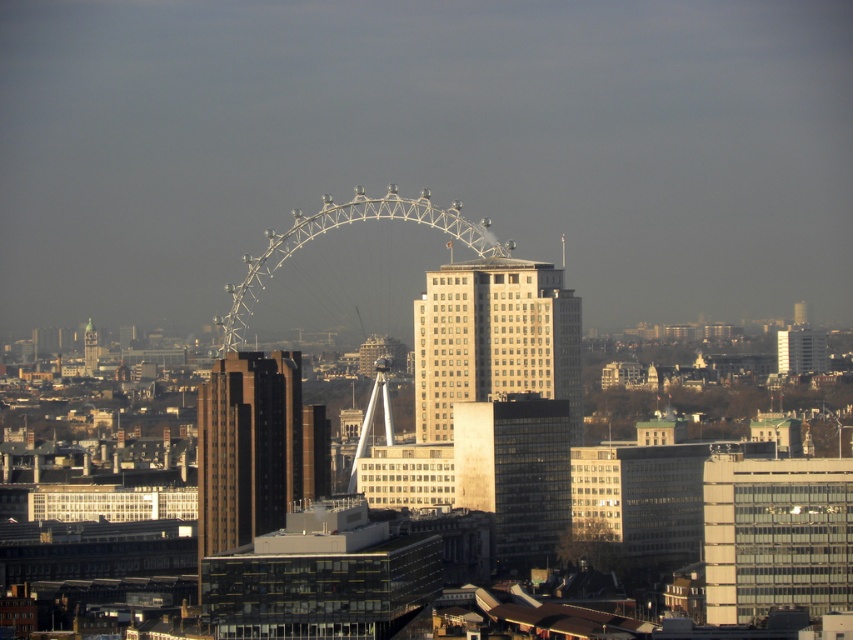
Is brown glassy building at center-left to the right of glassy reflective building at center from the viewer's perspective?

Incorrect, brown glassy building at center-left is not on the right side of glassy reflective building at center.

Is point (271, 512) less distant than point (463, 404)?

That is False.

Is point (224, 456) positioned behind point (457, 438)?

That is True.

Identify the location of brown glassy building at center-left. (247, 448).

Which is below, beige glass building at center or brown glassy building at center-left?

brown glassy building at center-left is below.

Measure the distance between beige glass building at center and brown glassy building at center-left.

beige glass building at center is 43.11 meters away from brown glassy building at center-left.

You are a GUI agent. You are given a task and a screenshot of the screen. Output one action in this format:
    pyautogui.click(x=<x>, y=<y>)
    Task: Click on the beige glass building at center
    Image resolution: width=853 pixels, height=640 pixels.
    Given the screenshot: What is the action you would take?
    pyautogui.click(x=494, y=339)

Can you confirm if beige glass building at center is positioned to the right of green glass tower at left?

Correct, you'll find beige glass building at center to the right of green glass tower at left.

Consider the image. Between beige glass building at center and green glass tower at left, which one appears on the right side from the viewer's perspective?

beige glass building at center

Who is more forward, (519, 372) or (85, 342)?

Point (519, 372) is more forward.

This screenshot has height=640, width=853. Find the location of `beige glass building at center`. beige glass building at center is located at coordinates (494, 339).